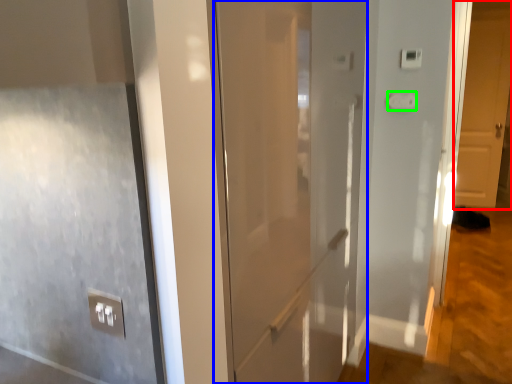
Question: Estimate the real-world distances between objects in this image. Which object is closer to door (highlighted by a red box), door (highlighted by a blue box) or light switch (highlighted by a green box)?

Choices:
 (A) door
 (B) light switch

Answer: (B)